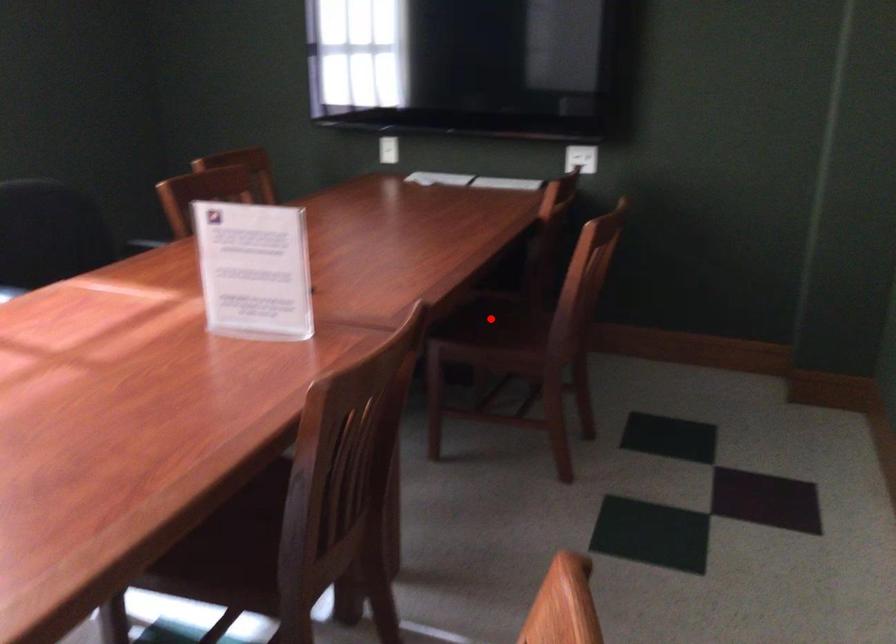
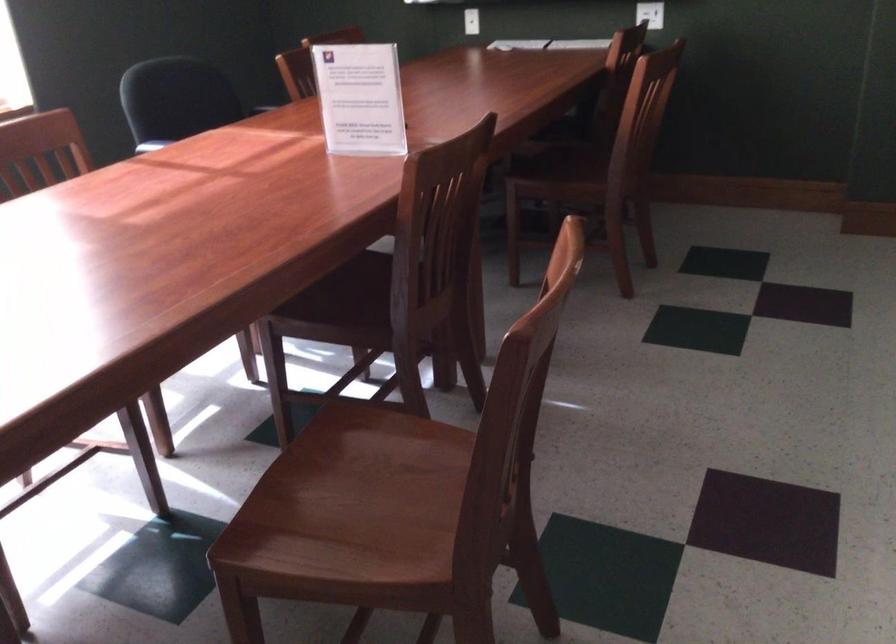
Question: I am providing you with two images of the same scene from different viewpoints. A red point is shown in image1. For the corresponding object point in image2, is it positioned nearer or farther from the camera?

Choices:
 (A) Nearer
 (B) Farther

Answer: (B)